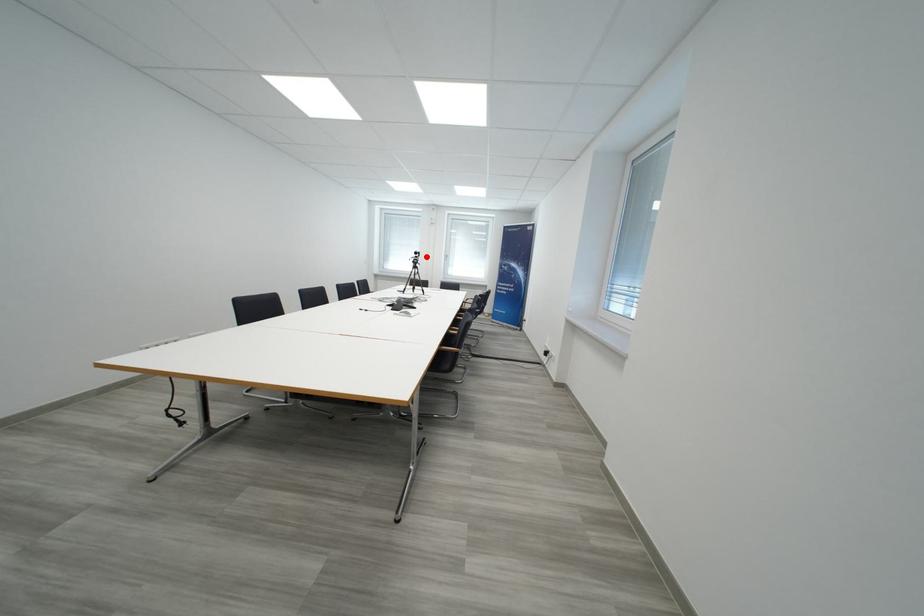
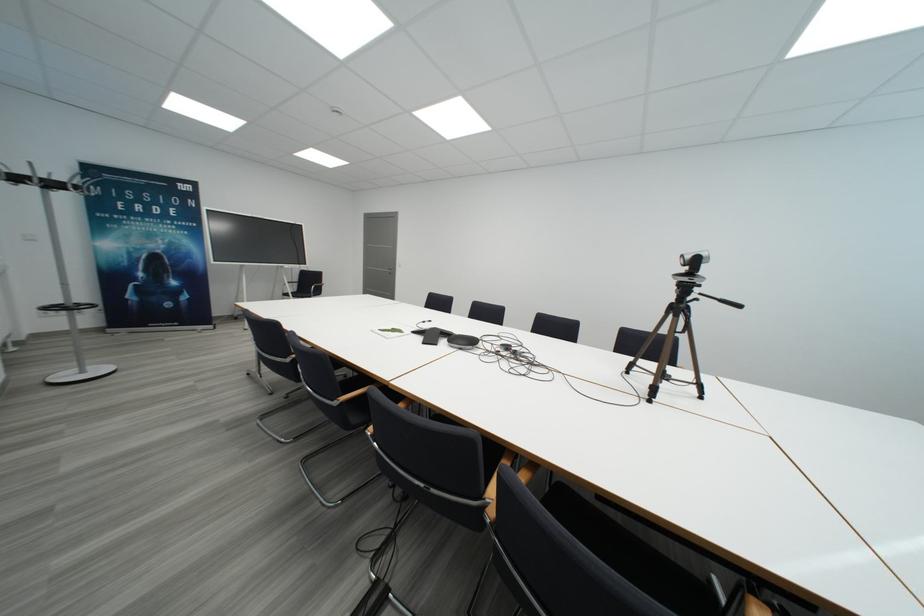
Question: I am providing you with two images of the same scene from different viewpoints. In image1, a red point is highlighted. Considering the same 3D point in image2, which of the following is correct?

Choices:
 (A) It is closer
 (B) It is farther

Answer: (B)